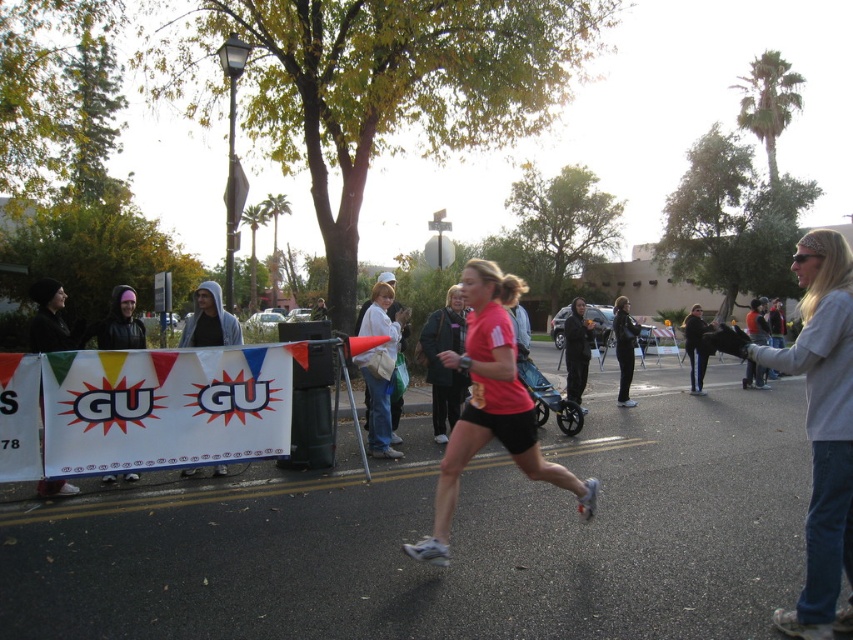
You are a runner in the race and you see a gray cotton sweatshirt at right. Can you tell me where the point at coordinate (817,424) is located?

The point at coordinate (817,424) is located on the gray cotton sweatshirt at right.

You are a photographer trying to capture both the gray hoodie at center and the black leather jacket at center in a single frame. Which object should you focus on first to ensure both are in the frame?

The gray hoodie at center is bigger than the black leather jacket at center, so you should focus on the gray hoodie at center first to ensure both fit within the frame.

You are a participant in the race and need to remove your outerwear. Which item is easier to take off first, the gray cotton sweatshirt at right or the black leather jacket at center?

The gray cotton sweatshirt at right is positioned over the black leather jacket at center, so you can take off the gray cotton sweatshirt at right first.